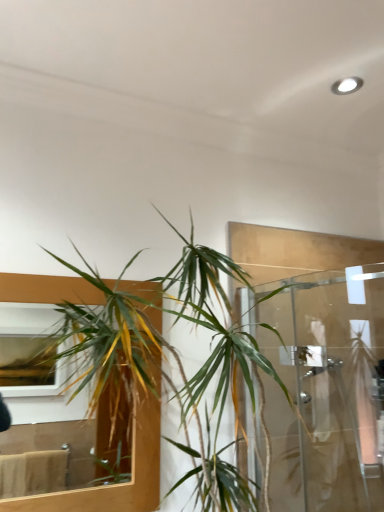
Question: From a real-world perspective, is green leafy plant at left physically located above or below clear glass shower door at right?

Choices:
 (A) above
 (B) below

Answer: (A)

Question: Considering the positions of point (92, 366) and point (347, 470), is point (92, 366) closer or farther from the camera than point (347, 470)?

Choices:
 (A) farther
 (B) closer

Answer: (B)

Question: Which object is the closest to the clear glass shower door at right?

Choices:
 (A) green leafy plant at center
 (B) green leafy plant at left

Answer: (A)

Question: Which object is positioned farthest from the clear glass shower door at right?

Choices:
 (A) green leafy plant at center
 (B) green leafy plant at left

Answer: (B)